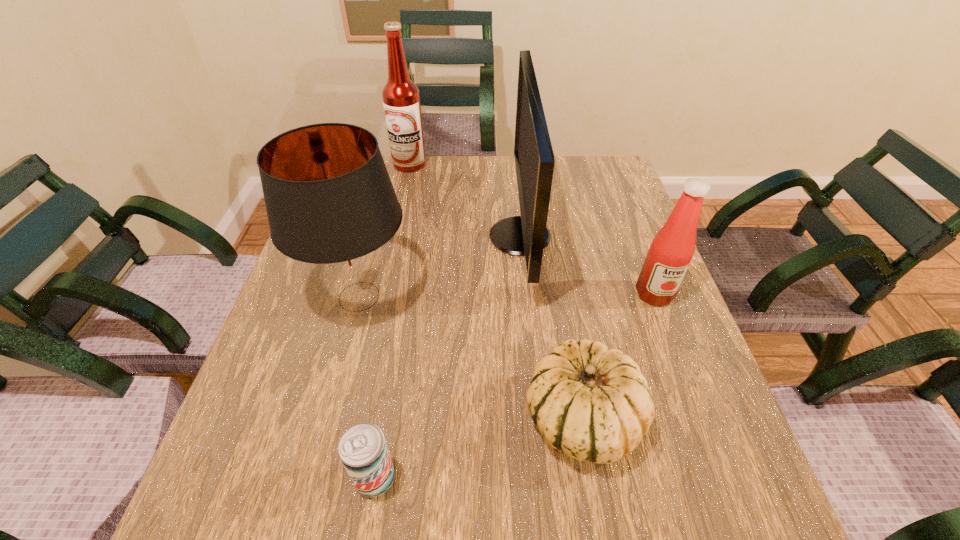
Locate an element on the screen. the farthest object is located at coordinates (401, 98).

Where is `computer monitor`? The image size is (960, 540). computer monitor is located at coordinates (527, 234).

Where is `lampshade`? Image resolution: width=960 pixels, height=540 pixels. lampshade is located at coordinates (331, 206).

Where is `the rightmost object`? the rightmost object is located at coordinates (671, 251).

Find the location of a particular element. The height and width of the screenshot is (540, 960). the fourth tallest object is located at coordinates (671, 251).

The image size is (960, 540). In order to click on gourd in this screenshot , I will do `click(591, 402)`.

This screenshot has height=540, width=960. In order to click on the shortest object in this screenshot , I will do `click(363, 450)`.

Where is `free point located 0.320m on the label side of the farthest object`? The height and width of the screenshot is (540, 960). free point located 0.320m on the label side of the farthest object is located at coordinates (394, 240).

This screenshot has height=540, width=960. I want to click on free region located on the front-facing side of the computer monitor, so click(x=360, y=237).

Identify the location of vacant space located on the front-facing side of the computer monitor. The width and height of the screenshot is (960, 540). (451, 237).